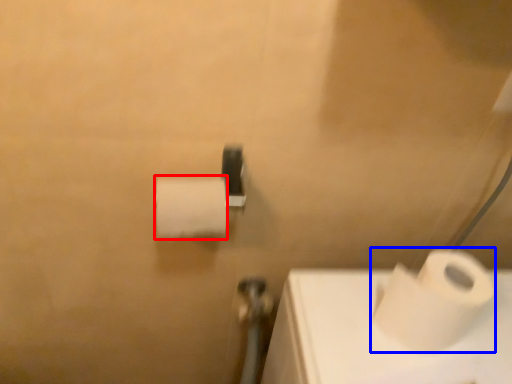
Question: Which object is closer to the camera taking this photo, toilet paper (highlighted by a red box) or toilet paper (highlighted by a blue box)?

Choices:
 (A) toilet paper
 (B) toilet paper

Answer: (B)